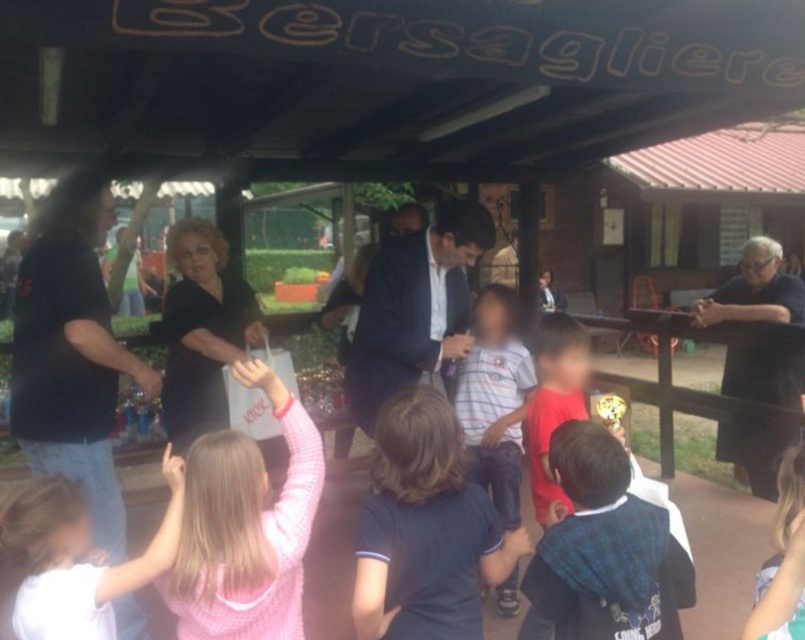
Question: Can you confirm if light pink sweater at lower left is positioned below striped cotton shirt at center?

Choices:
 (A) no
 (B) yes

Answer: (B)

Question: Estimate the real-world distances between objects in this image. Which object is closer to the dark blue suit at center?

Choices:
 (A) pink fleece sweater at lower left
 (B) black fabric at right

Answer: (A)

Question: Which point is closer to the camera taking this photo?

Choices:
 (A) (446, 328)
 (B) (40, 452)

Answer: (B)

Question: Considering the real-world distances, which object is farthest from the black fabric at right?

Choices:
 (A) dark blue textured shirt at center
 (B) pink fleece sweater at lower left
 (C) striped cotton shirt at center

Answer: (B)

Question: Does black fabric at right have a greater width compared to striped cotton shirt at center?

Choices:
 (A) no
 (B) yes

Answer: (B)

Question: Is black matte shirt at left thinner than light pink sweater at lower left?

Choices:
 (A) yes
 (B) no

Answer: (B)